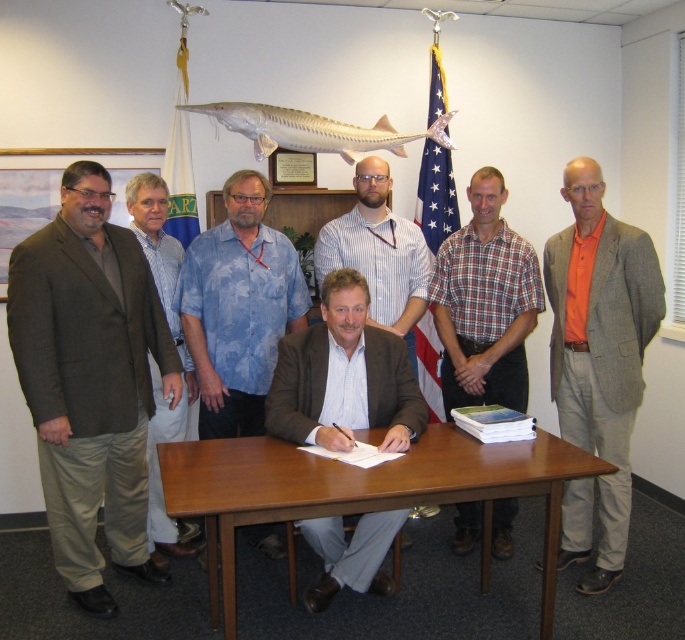
Which is more to the left, brown wooden table at center or shiny silver fish at upper center?

Positioned to the left is shiny silver fish at upper center.

Does brown wooden table at center come behind shiny silver fish at upper center?

No, brown wooden table at center is in front of shiny silver fish at upper center.

Describe the element at coordinates (361, 492) in the screenshot. I see `brown wooden table at center` at that location.

Locate an element on the screen. This screenshot has width=685, height=640. brown wooden table at center is located at coordinates tap(361, 492).

What do you see at coordinates (485, 304) in the screenshot?
I see `plaid shirt at center` at bounding box center [485, 304].

Find the location of `plaid shirt at center`. plaid shirt at center is located at coordinates (485, 304).

Between point (271, 141) and point (423, 163), which one is positioned behind?

The point (423, 163) is behind.

What do you see at coordinates (312, 131) in the screenshot? Image resolution: width=685 pixels, height=640 pixels. I see `shiny silver fish at upper center` at bounding box center [312, 131].

Where is `shiny silver fish at upper center`? shiny silver fish at upper center is located at coordinates (312, 131).